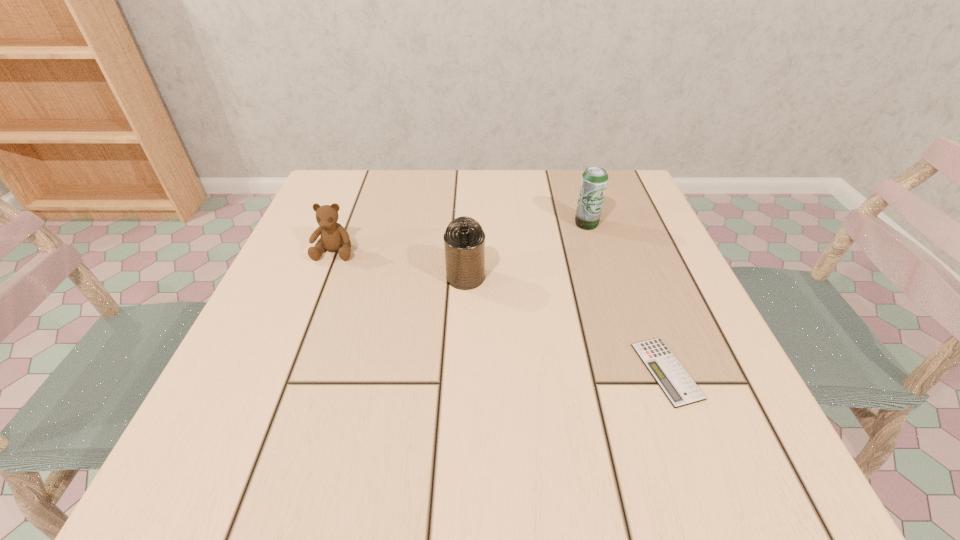
I want to click on vacant space located 0.380m on the left of the nearest object, so click(x=394, y=371).

In order to click on object at the far edge in this screenshot , I will do `click(594, 180)`.

Find the location of a particular element. Image resolution: width=960 pixels, height=540 pixels. object at the left edge is located at coordinates (334, 237).

The image size is (960, 540). I want to click on beer can that is at the right edge, so click(x=594, y=180).

Identify the location of calculator located at the right edge. The image size is (960, 540). (675, 382).

Locate an element on the screen. The height and width of the screenshot is (540, 960). object that is at the far right corner is located at coordinates (594, 180).

Find the location of a particular element. The height and width of the screenshot is (540, 960). free space at the far edge is located at coordinates (471, 192).

Identify the location of vacant area at the near edge of the desktop. (621, 443).

The image size is (960, 540). I want to click on vacant space at the left edge of the desktop, so click(x=326, y=377).

Identify the location of vacant space at the right edge. The width and height of the screenshot is (960, 540). (632, 235).